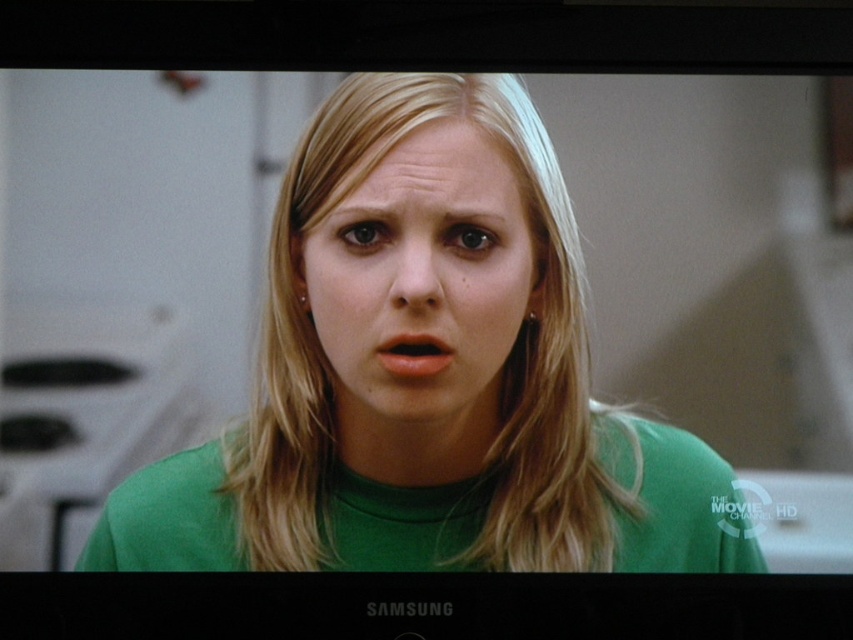
You are trying to determine which object occupies more space in the image. Looking at the green matte shirt at center and the matte green face at center, which one is larger?

The green matte shirt at center is bigger than the matte green face at center, so the green matte shirt at center occupies more space in the image.